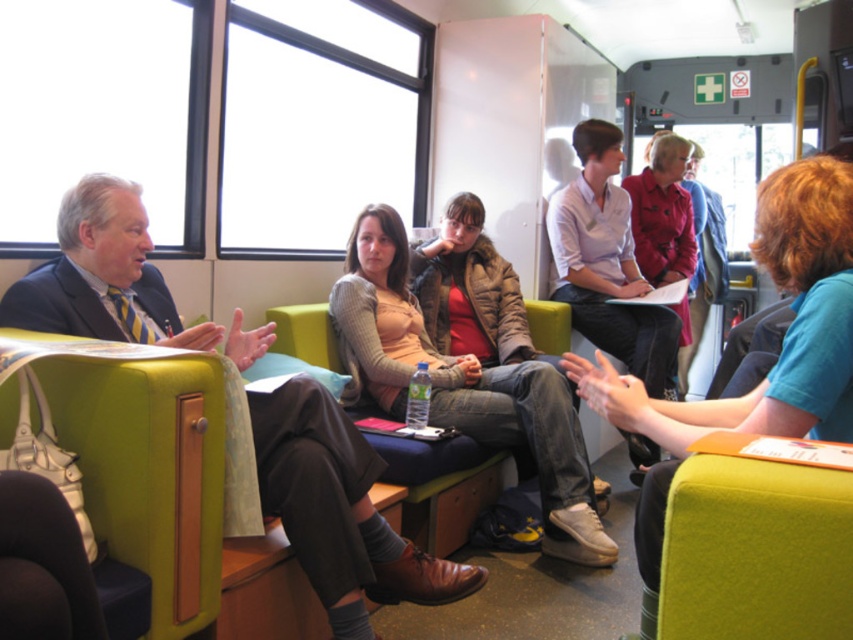
Where is `blue cotton shirt at center`? Image resolution: width=853 pixels, height=640 pixels. blue cotton shirt at center is located at coordinates (773, 364).

Is point (807, 275) less distant than point (845, 486)?

No, it is behind (845, 486).

Does point (827, 205) come behind point (706, 541)?

Yes, it is behind point (706, 541).

Where is `blue cotton shirt at center`? The image size is (853, 640). blue cotton shirt at center is located at coordinates tap(773, 364).

Can you confirm if blue cotton shirt at center is positioned below matte red coat at center?

Correct, blue cotton shirt at center is located below matte red coat at center.

The image size is (853, 640). Find the location of `blue cotton shirt at center`. blue cotton shirt at center is located at coordinates point(773,364).

Between point (767, 196) and point (639, 269), which one is positioned behind?

Point (639, 269)

Where is `blue cotton shirt at center`? This screenshot has height=640, width=853. blue cotton shirt at center is located at coordinates (773, 364).

Is the position of green felt chair at lower right less distant than that of matte red coat at center?

Yes.

Can you confirm if green felt chair at lower right is smaller than matte red coat at center?

Yes.

At what (x,y) coordinates should I click in order to perform the action: click on green felt chair at lower right. Please return your answer as a coordinate pair (x, y). The width and height of the screenshot is (853, 640). Looking at the image, I should click on (755, 552).

The width and height of the screenshot is (853, 640). In order to click on green felt chair at lower right in this screenshot , I will do `click(755, 552)`.